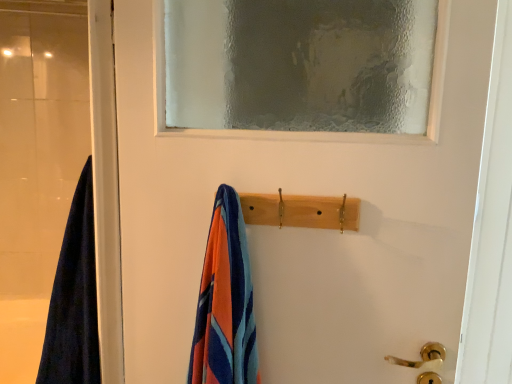
Question: Should I look upward or downward to see dark blue fabric at left?

Choices:
 (A) down
 (B) up

Answer: (A)